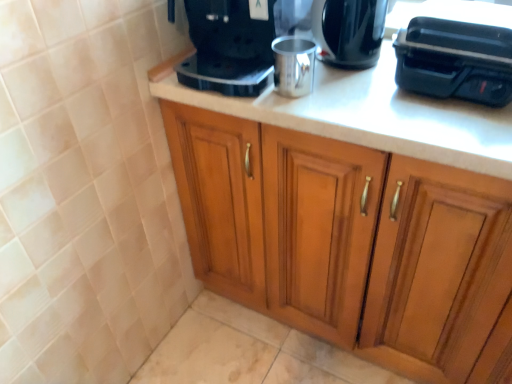
Where is `vacant area in front of black plastic toaster at upper right, acting as the 1th appliance starting from the right`? This screenshot has height=384, width=512. vacant area in front of black plastic toaster at upper right, acting as the 1th appliance starting from the right is located at coordinates point(455,129).